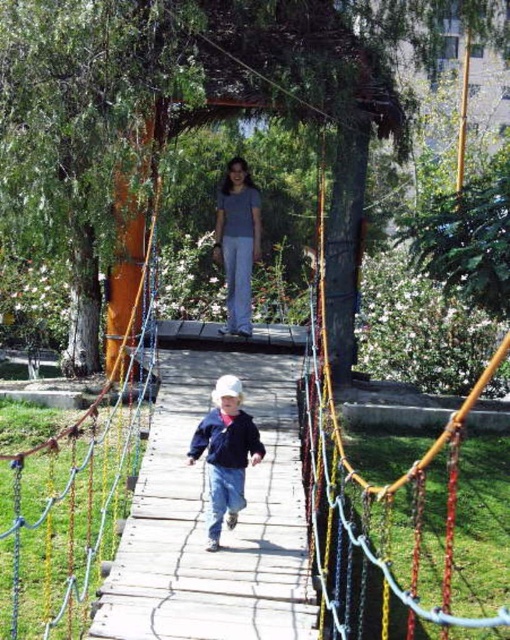
Who is lower down, denim jacket at center or matte gray shirt at center?

Positioned lower is denim jacket at center.

Can you confirm if denim jacket at center is bigger than matte gray shirt at center?

Result: No, denim jacket at center is not bigger than matte gray shirt at center.

Is point (212, 454) positioned before point (215, 256)?

That is True.

The height and width of the screenshot is (640, 510). What are the coordinates of `denim jacket at center` in the screenshot? It's located at (225, 452).

Can you confirm if wooden plank bridge at center is shorter than denim jacket at center?

No.

Looking at this image, is wooden plank bridge at center thinner than denim jacket at center?

In fact, wooden plank bridge at center might be wider than denim jacket at center.

Identify the location of wooden plank bridge at center. This screenshot has height=640, width=510. (208, 515).

Find the location of a particular element. This screenshot has width=510, height=640. wooden plank bridge at center is located at coordinates (208, 515).

Between wooden plank bridge at center and matte gray shirt at center, which one has less height?

wooden plank bridge at center is shorter.

Where is `wooden plank bridge at center`? This screenshot has height=640, width=510. wooden plank bridge at center is located at coordinates (208, 515).

Does point (161, 522) come behind point (235, 220)?

No, it is not.

The height and width of the screenshot is (640, 510). I want to click on wooden plank bridge at center, so click(208, 515).